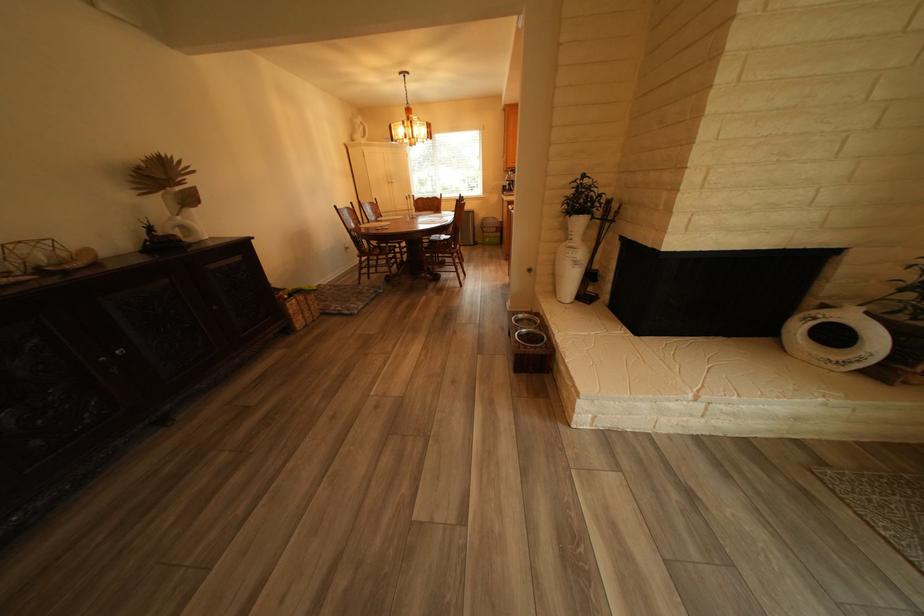
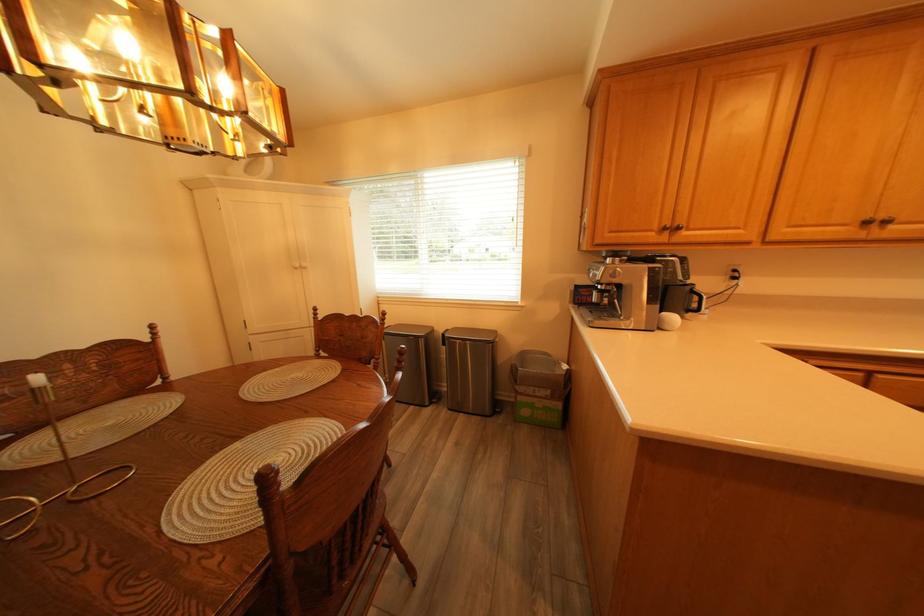
The point at (521, 188) is marked in the first image. Where is the corresponding point in the second image?

(609, 301)